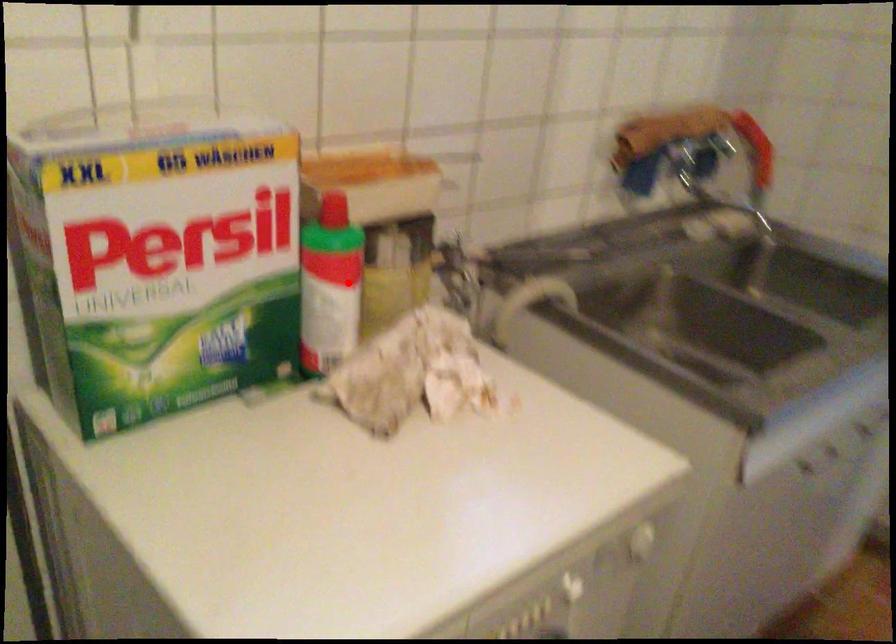
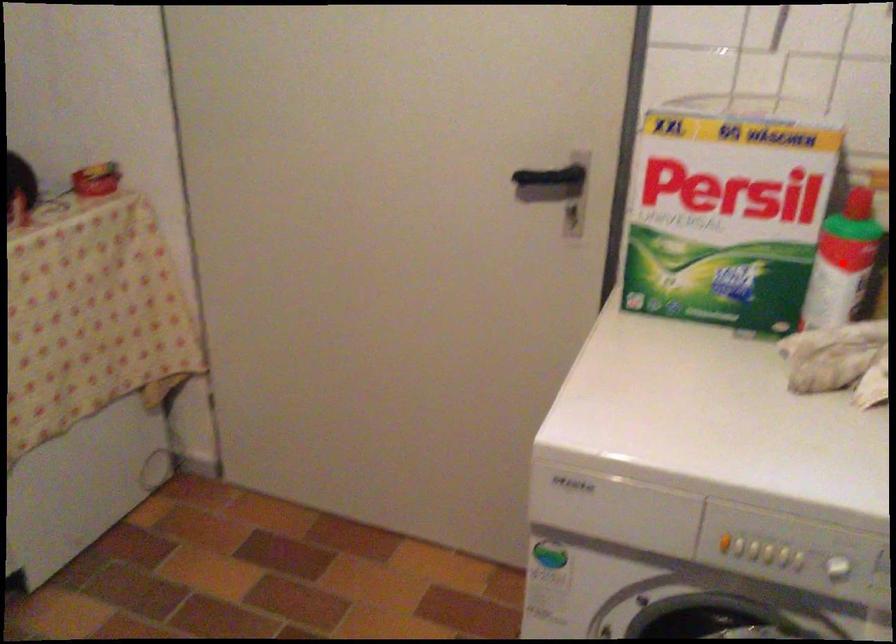
I am providing you with two images of the same scene from different viewpoints. A red point is marked on the first image and another point is marked on the second image. Does the point marked in image1 correspond to the same location as the one in image2?

Yes